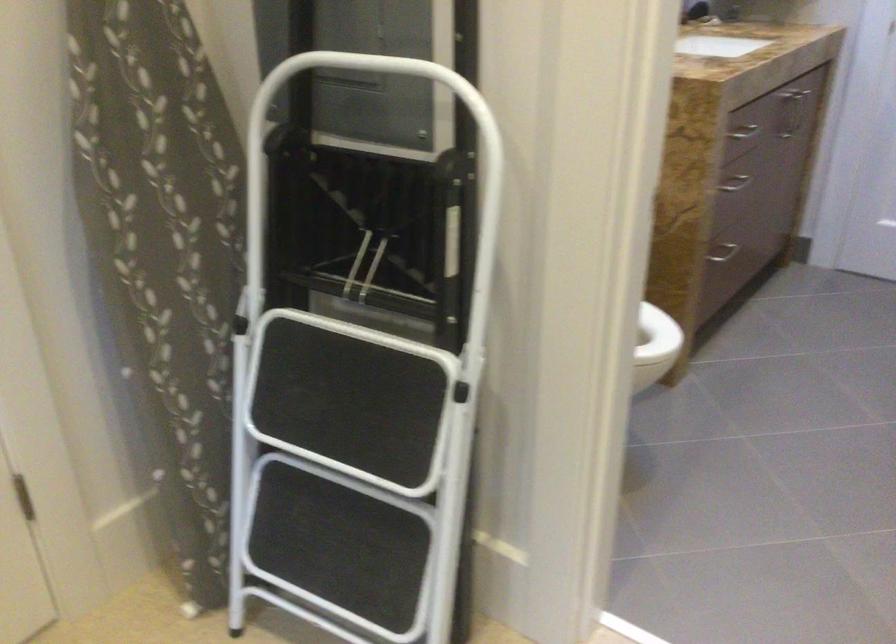
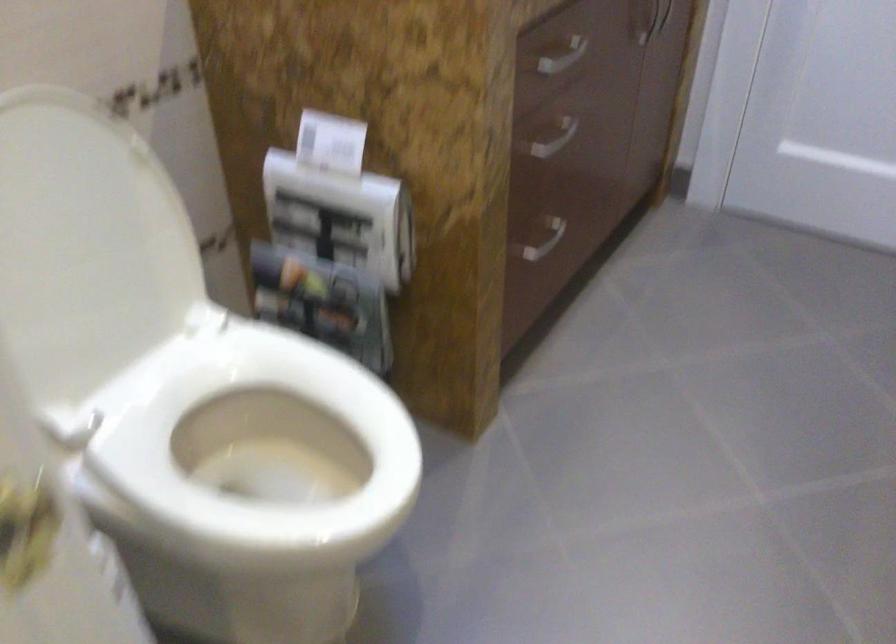
The point at (734, 192) is marked in the first image. Where is the corresponding point in the second image?

(554, 138)